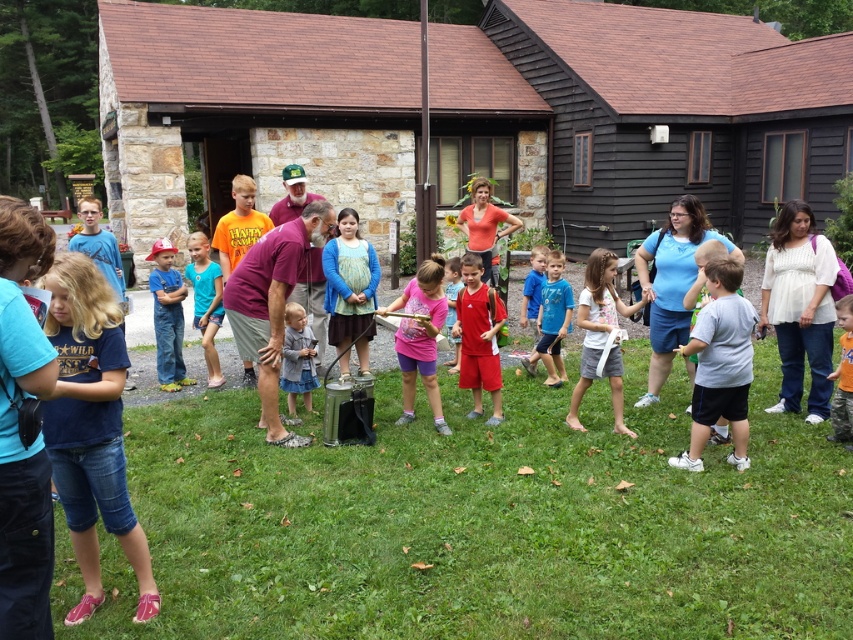
Question: Can you confirm if brown stone hut at center is positioned to the left of matte red shorts at center?

Choices:
 (A) yes
 (B) no

Answer: (A)

Question: Is pink matte shirt at center positioned behind orange cotton shirt at center?

Choices:
 (A) yes
 (B) no

Answer: (A)

Question: Which of the following is the farthest from the observer?

Choices:
 (A) blue cotton shirt at center
 (B) brown stone hut at center

Answer: (B)

Question: Among these objects, which one is nearest to the camera?

Choices:
 (A) dark brown wooden hut at center
 (B) blue textured shirt at center
 (C) blue denim shorts at lower left
 (D) matte blue shorts at center

Answer: (C)

Question: Considering the real-world distances, which object is farthest from the orange cotton shirt at center?

Choices:
 (A) blue textured shirt at center
 (B) pink matte shirt at center
 (C) matte blue shorts at center
 (D) white cotton shirt at center

Answer: (C)

Question: Considering the relative positions of gray matte shirt at center and denim jeans at center in the image provided, where is gray matte shirt at center located with respect to denim jeans at center?

Choices:
 (A) left
 (B) right

Answer: (B)